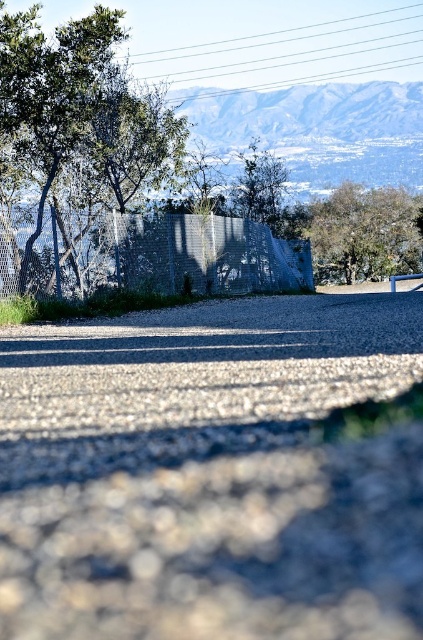
Can you confirm if green leafy tree at left is positioned above green leafy tree at upper right?

No, green leafy tree at left is not above green leafy tree at upper right.

Which of these two, green leafy tree at left or green leafy tree at upper right, stands taller?

green leafy tree at left

Does point (57, 122) come farther from viewer compared to point (326, 232)?

No, it is not.

I want to click on green leafy tree at left, so click(77, 118).

Where is `gray gravel at center`? This screenshot has height=640, width=423. gray gravel at center is located at coordinates (211, 474).

Is gray gravel at center bigger than green leafy tree at left?

Actually, gray gravel at center might be smaller than green leafy tree at left.

Is point (280, 422) farther from camera compared to point (57, 49)?

No.

Find the location of `gray gravel at center`. gray gravel at center is located at coordinates (211, 474).

Is gray gravel at center bigger than green leafy tree at upper right?

Incorrect, gray gravel at center is not larger than green leafy tree at upper right.

Between gray gravel at center and green leafy tree at upper right, which one has more height?

Standing taller between the two is green leafy tree at upper right.

The height and width of the screenshot is (640, 423). I want to click on gray gravel at center, so click(x=211, y=474).